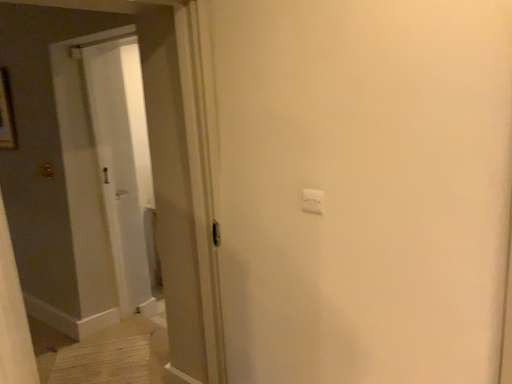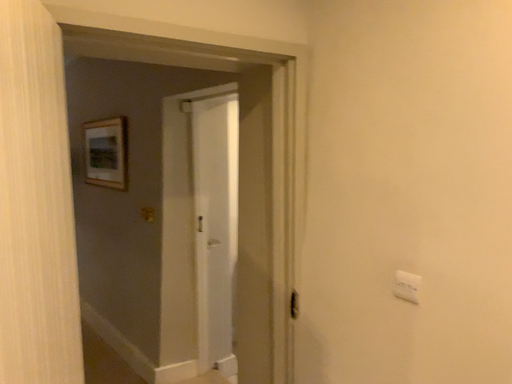
Question: Which way did the camera rotate in the video?

Choices:
 (A) rotated left
 (B) rotated right

Answer: (A)